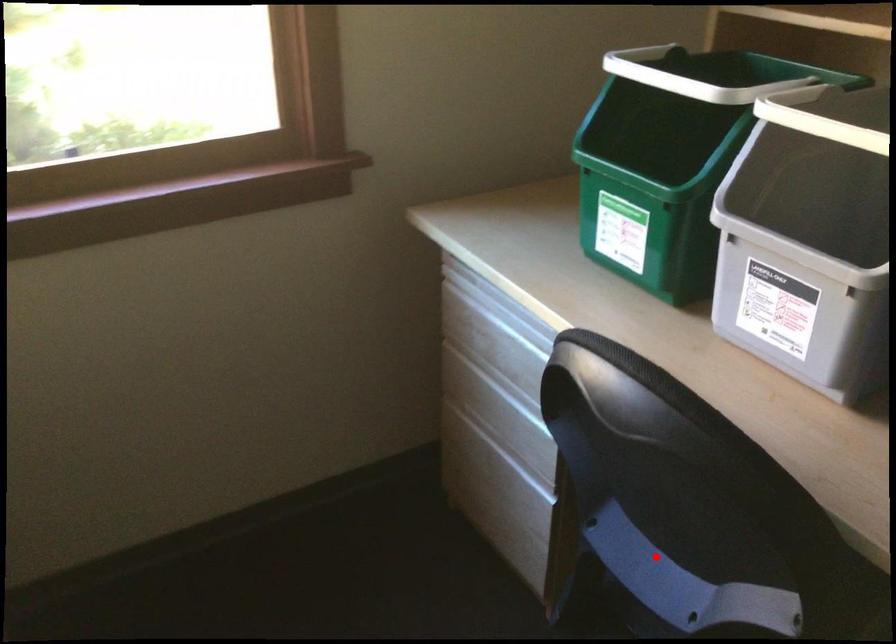
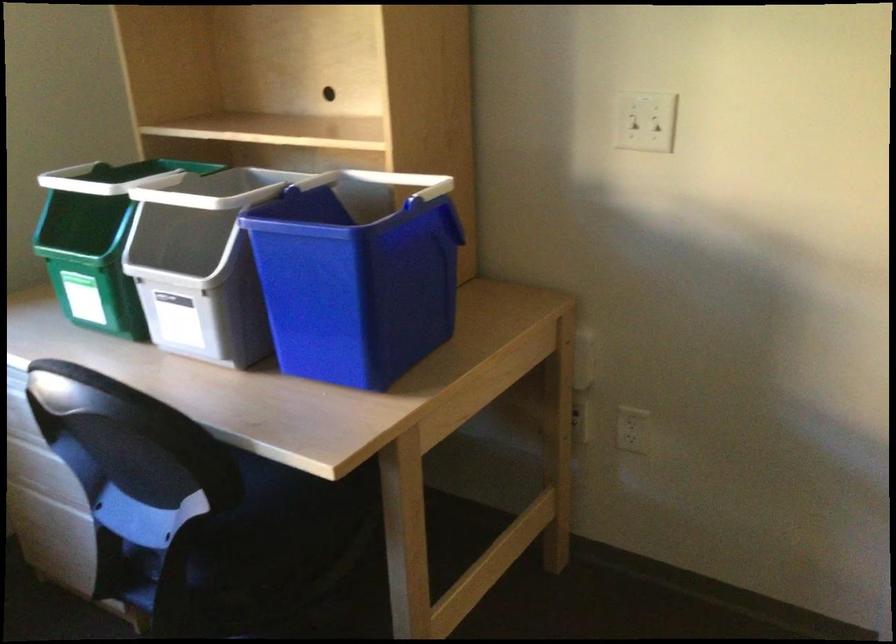
Question: A red point is marked in image1. In image2, is the corresponding 3D point closer to the camera or farther? Reply with the corresponding letter.

Choices:
 (A) The corresponding 3D point is closer.
 (B) The corresponding 3D point is farther.

Answer: (B)